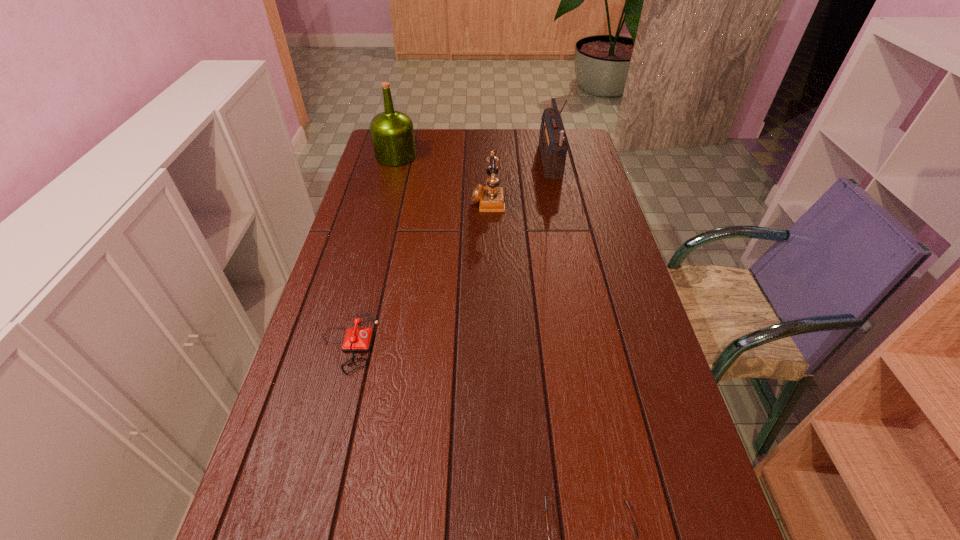
Where is `the tallest object`? The width and height of the screenshot is (960, 540). the tallest object is located at coordinates (553, 143).

Locate an element on the screen. the fourth shortest object is located at coordinates (392, 132).

Image resolution: width=960 pixels, height=540 pixels. What are the coordinates of `the farther telephone` in the screenshot? It's located at (490, 197).

The width and height of the screenshot is (960, 540). In order to click on the third tallest object in this screenshot , I will do `click(490, 197)`.

The height and width of the screenshot is (540, 960). I want to click on the nearer telephone, so click(356, 339).

Where is `the left telephone`? This screenshot has height=540, width=960. the left telephone is located at coordinates (356, 339).

This screenshot has width=960, height=540. Identify the location of free spot located on the front-facing side of the radio receiver. (440, 162).

Identify the location of free space located 0.140m on the front-facing side of the radio receiver. (505, 162).

This screenshot has width=960, height=540. I want to click on vacant region located on the front-facing side of the radio receiver, so click(447, 162).

I want to click on free region located 0.240m on the front of the olive oil, so click(383, 204).